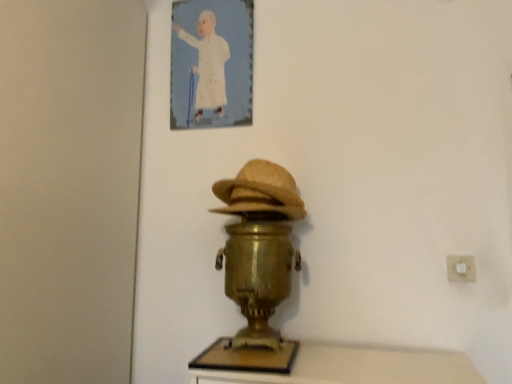
Question: Would you consider white plastic electric outlet at lower right to be distant from gold metallic samovar at center?

Choices:
 (A) no
 (B) yes

Answer: (A)

Question: Is white plastic electric outlet at lower right positioned in front of gold metallic samovar at center?

Choices:
 (A) no
 (B) yes

Answer: (A)

Question: Does white plastic electric outlet at lower right turn towards gold metallic samovar at center?

Choices:
 (A) no
 (B) yes

Answer: (A)

Question: From the image's perspective, is white plastic electric outlet at lower right beneath gold metallic samovar at center?

Choices:
 (A) yes
 (B) no

Answer: (B)

Question: Would you say white plastic electric outlet at lower right is outside gold metallic samovar at center?

Choices:
 (A) no
 (B) yes

Answer: (B)

Question: Based on their sizes in the image, would you say bleached straw hat at center is bigger or smaller than white plastic electric outlet at lower right?

Choices:
 (A) small
 (B) big

Answer: (B)

Question: Relative to white plastic electric outlet at lower right, is bleached straw hat at center in front or behind?

Choices:
 (A) front
 (B) behind

Answer: (A)

Question: From their relative heights in the image, would you say bleached straw hat at center is taller or shorter than white plastic electric outlet at lower right?

Choices:
 (A) short
 (B) tall

Answer: (B)

Question: Choose the correct answer: Is bleached straw hat at center inside white plastic electric outlet at lower right or outside it?

Choices:
 (A) inside
 (B) outside

Answer: (B)

Question: Is white plastic electric outlet at lower right inside the boundaries of white paper at upper center, or outside?

Choices:
 (A) inside
 (B) outside

Answer: (B)

Question: Is point (454, 281) closer or farther from the camera than point (201, 79)?

Choices:
 (A) farther
 (B) closer

Answer: (B)

Question: From the image's perspective, is white plastic electric outlet at lower right positioned above or below white paper at upper center?

Choices:
 (A) below
 (B) above

Answer: (A)

Question: From a real-world perspective, relative to white paper at upper center, is white plastic electric outlet at lower right vertically above or below?

Choices:
 (A) above
 (B) below

Answer: (B)

Question: From a real-world perspective, relative to white plastic electric outlet at lower right, is gold metallic samovar at center vertically above or below?

Choices:
 (A) above
 (B) below

Answer: (B)

Question: From the image's perspective, is gold metallic samovar at center positioned above or below white plastic electric outlet at lower right?

Choices:
 (A) above
 (B) below

Answer: (B)